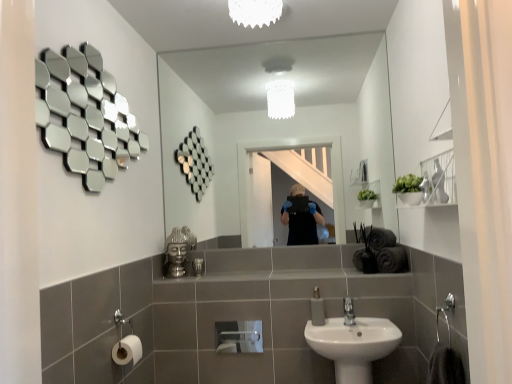
I want to click on free space in front of silver metallic faucet at lower center, so click(x=354, y=329).